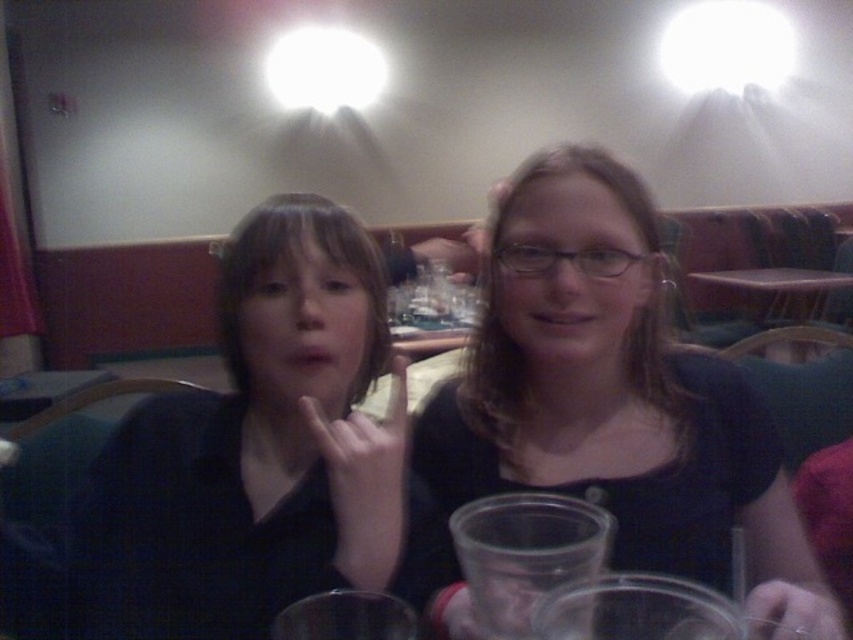
You are a photographer trying to capture a clear photo of the matte black shirt at center and the purple plastic table at center. Since the two bright lights at the top are causing glare, which object should you focus on first to avoid overexposure?

The matte black shirt at center has a greater height compared to the purple plastic table at center, so you should focus on the matte black shirt at center first to avoid overexposure.

You are a photographer standing in the restaurant scene. You want to take a closeup shot of the matte black shirt at center without moving any objects. Can you get within 50 centimeters of the shirt?

The matte black shirt at center is 53.49 centimeters away from the viewer. Since you need to be within 50 centimeters, you cannot get close enough without moving any objects.